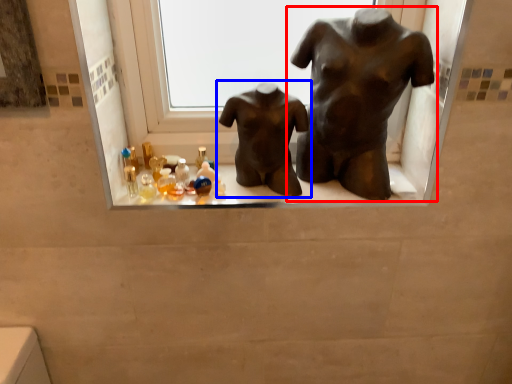
Question: Among these objects, which one is nearest to the camera, statue (sculpture) (highlighted by a red box) or statue (sculpture) (highlighted by a blue box)?

Choices:
 (A) statue (sculpture)
 (B) statue (sculpture)

Answer: (A)